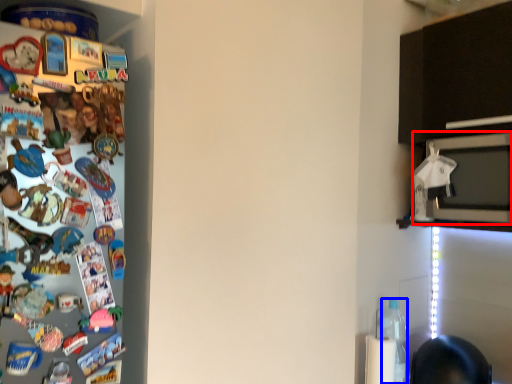
Question: Which point is closer to the camera, microwave oven (highlighted by a red box) or bottle (highlighted by a blue box)?

Choices:
 (A) microwave oven
 (B) bottle

Answer: (A)